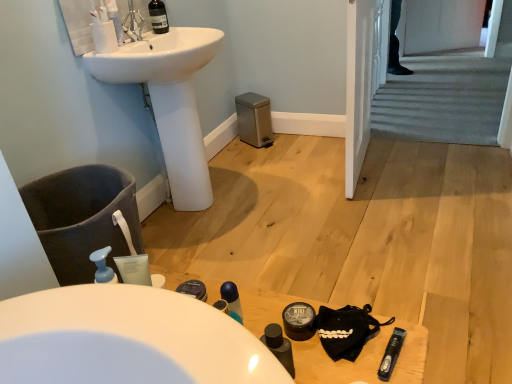
Question: Do you think transparent glass wine bottle at upper center is within carpeted stairs at center, or outside of it?

Choices:
 (A) inside
 (B) outside

Answer: (B)

Question: From the image's perspective, is transparent glass wine bottle at upper center positioned above or below carpeted stairs at center?

Choices:
 (A) below
 (B) above

Answer: (A)

Question: Based on their relative distances, which object is nearer to the transparent plastic mouthwash at lower right, placed as the third mouthwash when sorted from back to front?

Choices:
 (A) matte black container at lower center
 (B) white glossy sink at upper left
 (C) black matte table at lower center
 (D) blue plastic mouthwash at center, marked as the second mouthwash in a front-to-back arrangement
 (E) carpeted stairs at center

Answer: (A)

Question: Which object is positioned farthest from the white glossy sink at upper left?

Choices:
 (A) transparent glass wine bottle at upper center
 (B) matte black container at lower center
 (C) carpeted stairs at center
 (D) black matte table at lower center
 (E) blue plastic mouthwash at center, marked as the second mouthwash in a front-to-back arrangement

Answer: (C)